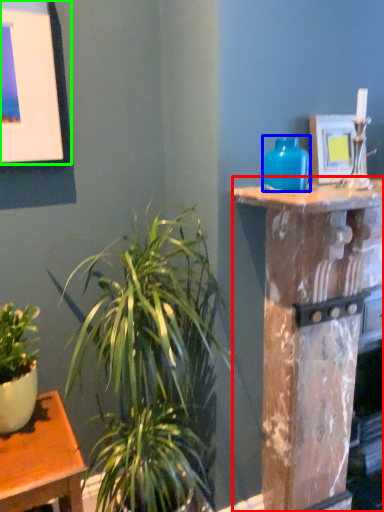
Question: Which object is positioned closest to pillar (highlighted by a red box)? Select from vase (highlighted by a blue box) and picture frame (highlighted by a green box).

Choices:
 (A) vase
 (B) picture frame

Answer: (A)